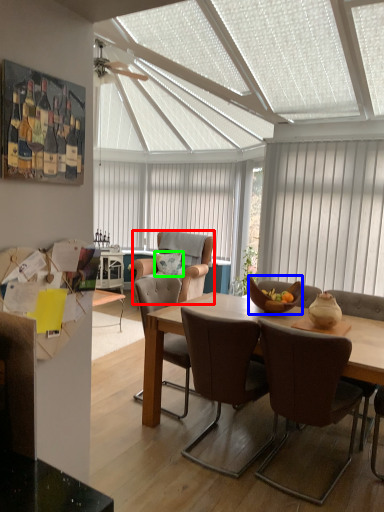
Question: Which is nearer to the chair (highlighted by a red box)? bowl (highlighted by a blue box) or pillow (highlighted by a green box).

Choices:
 (A) bowl
 (B) pillow

Answer: (B)